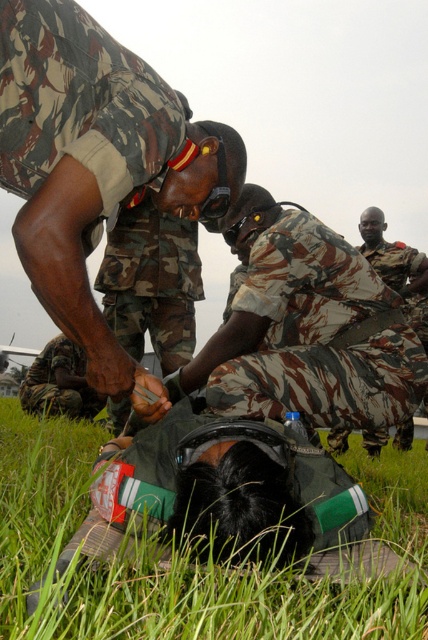
Does camo uniform at center have a greater width compared to camouflage uniform at center?

No, camo uniform at center is not wider than camouflage uniform at center.

Does camo uniform at center appear on the right side of camouflage uniform at center?

No, camo uniform at center is not to the right of camouflage uniform at center.

The image size is (428, 640). I want to click on camo uniform at center, so click(x=92, y=164).

Identify the location of green grass at lower center. (155, 564).

Who is more distant from viewer, (407,611) or (293,401)?

Point (293,401)

Who is more distant from viewer, (33, 563) or (217, 330)?

Positioned behind is point (217, 330).

The width and height of the screenshot is (428, 640). What are the coordinates of `green grass at lower center` in the screenshot? It's located at (155, 564).

Can you confirm if camo uniform at center is positioned to the right of green grass at lower center?

Incorrect, camo uniform at center is not on the right side of green grass at lower center.

Between camo uniform at center and green grass at lower center, which one appears on the right side from the viewer's perspective?

green grass at lower center is more to the right.

Is point (23, 192) more distant than point (79, 614)?

Yes, it is behind point (79, 614).

The image size is (428, 640). What are the coordinates of `camo uniform at center` in the screenshot? It's located at (92, 164).